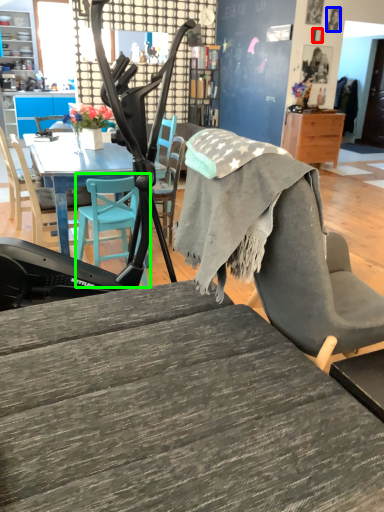
Question: Which is nearer to the picture frame (highlighted by a red box)? person (highlighted by a blue box) or chair (highlighted by a green box).

Choices:
 (A) person
 (B) chair

Answer: (A)